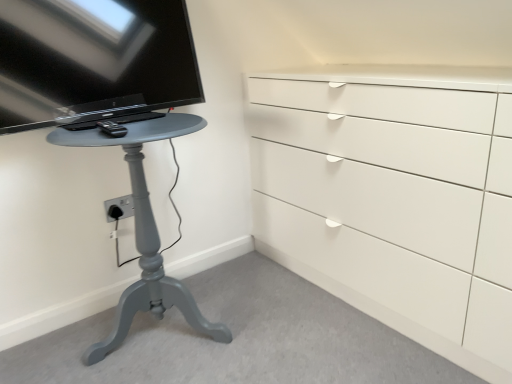
The width and height of the screenshot is (512, 384). In order to click on free space to the left of black plastic remote control at left in this screenshot , I will do `click(71, 124)`.